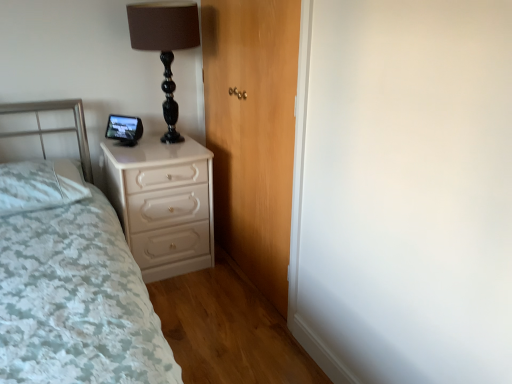
Question: Would you say black glossy table lamp at upper center is inside or outside white glossy chest of drawers at lower left?

Choices:
 (A) inside
 (B) outside

Answer: (B)

Question: From a real-world perspective, is black glossy table lamp at upper center positioned above or below white glossy chest of drawers at lower left?

Choices:
 (A) below
 (B) above

Answer: (B)

Question: Which object is positioned closest to the black glossy table lamp at upper center?

Choices:
 (A) white textured bed at left
 (B) white soft pillow at left
 (C) wooden door at center
 (D) white glossy chest of drawers at lower left

Answer: (C)

Question: Which object is the farthest from the wooden door at center?

Choices:
 (A) black glossy table lamp at upper center
 (B) white soft pillow at left
 (C) white textured bed at left
 (D) white glossy chest of drawers at lower left

Answer: (B)